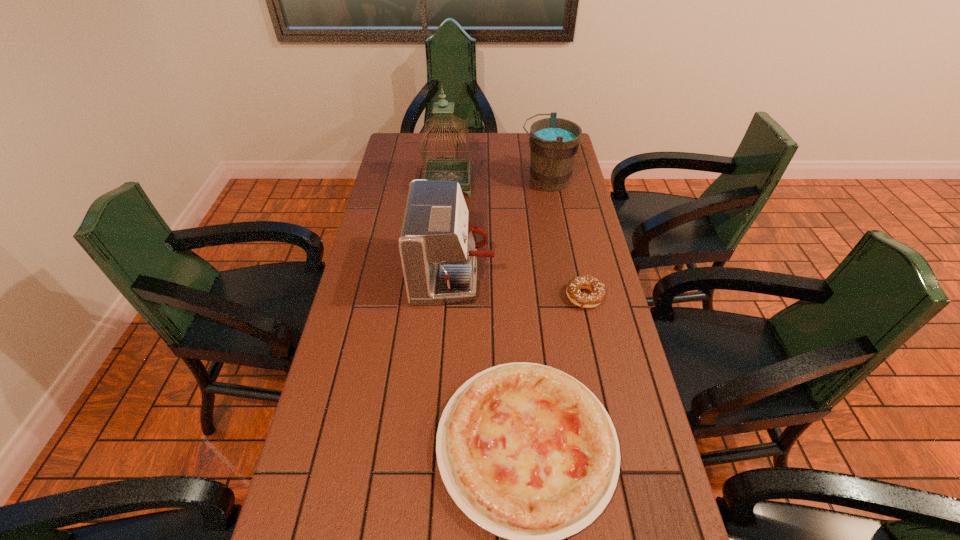
This screenshot has height=540, width=960. Find the location of `wine bucket that is at the right edge`. wine bucket that is at the right edge is located at coordinates (554, 142).

This screenshot has width=960, height=540. In order to click on doughnut present at the right edge in this screenshot , I will do `click(597, 288)`.

Where is `vacant space at the far edge of the desktop`? The width and height of the screenshot is (960, 540). vacant space at the far edge of the desktop is located at coordinates (477, 154).

Locate an element on the screen. free region at the left edge of the desktop is located at coordinates (376, 227).

Where is `vacant area at the right edge`? The image size is (960, 540). vacant area at the right edge is located at coordinates (585, 207).

In the image, there is a desktop. Where is `vacant area at the far left corner`? vacant area at the far left corner is located at coordinates (401, 135).

Identify the location of free point between the shortest object and the wine bucket. The width and height of the screenshot is (960, 540). (565, 239).

Identify the location of blank region between the coffee maker and the wine bucket. (499, 228).

You are a GUI agent. You are given a task and a screenshot of the screen. Output one action in this format:
    pyautogui.click(x=<x>, y=<y>)
    Task: Click on the free space between the birdcage and the wine bucket
    This screenshot has width=960, height=540.
    Given the screenshot: What is the action you would take?
    pyautogui.click(x=497, y=182)

At what (x,y) coordinates should I click in order to perform the action: click on vacant area between the shortest object and the wine bucket. Please return your answer as a coordinate pair (x, y). Looking at the image, I should click on (565, 239).